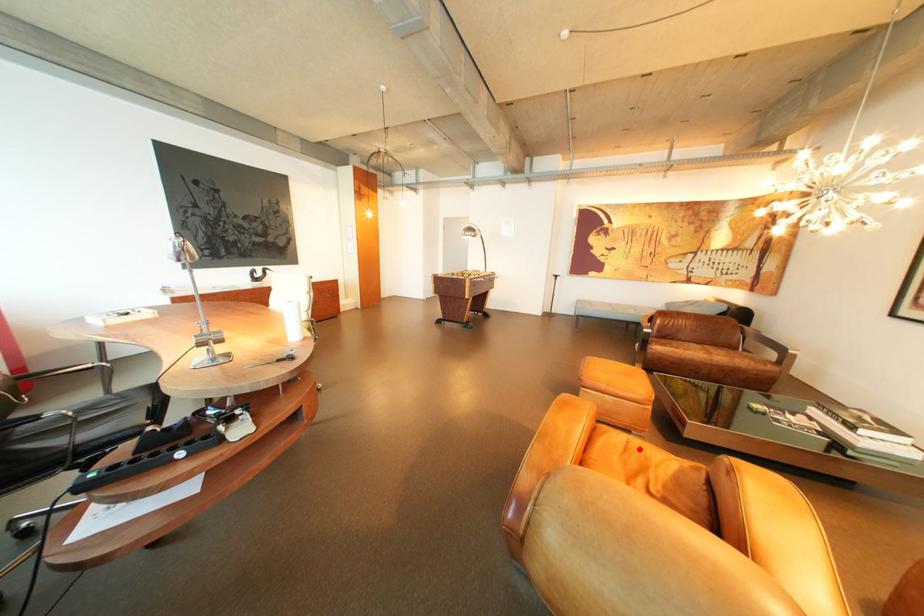
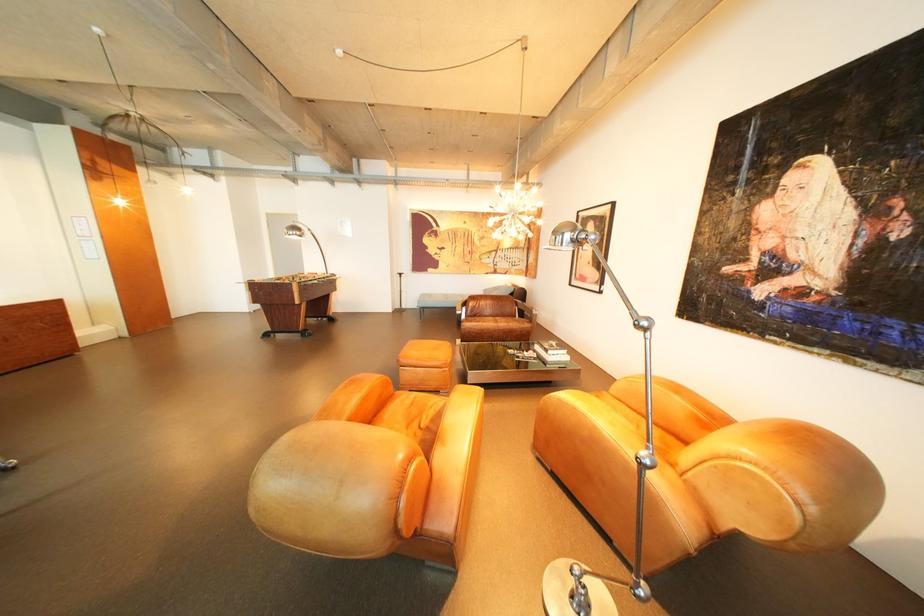
Question: I am providing you with two images of the same scene from different viewpoints. A red point is shown in image1. For the corresponding object point in image2, is it positioned nearer or farther from the camera?

Choices:
 (A) Nearer
 (B) Farther

Answer: (A)